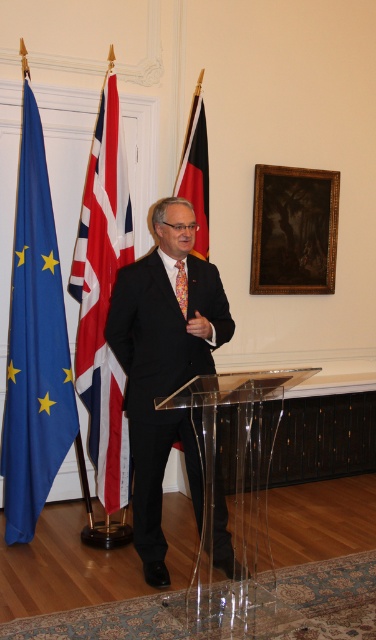
Which is more to the left, red and white striped flag at left or black matte flag at center?

red and white striped flag at left

Which is more to the right, red and white striped flag at left or black matte flag at center?

black matte flag at center

Find the location of a particular element. red and white striped flag at left is located at coordinates (103, 298).

This screenshot has width=376, height=640. What are the coordinates of `red and white striped flag at left` in the screenshot? It's located at (103, 298).

Is point (151, 497) in front of point (183, 310)?

No, (151, 497) is behind (183, 310).

Does black suit at center come in front of floral silk tie at center?

That is True.

Find the location of a particular element. This screenshot has width=376, height=640. black suit at center is located at coordinates (163, 364).

I want to click on black suit at center, so click(x=163, y=364).

Is red and white striped flag at left smaller than floral silk tie at center?

Actually, red and white striped flag at left might be larger than floral silk tie at center.

In the scene shown: Does red and white striped flag at left appear under floral silk tie at center?

No.

Does point (106, 221) lie behind point (175, 278)?

That is True.

The image size is (376, 640). What are the coordinates of `red and white striped flag at left` in the screenshot? It's located at (103, 298).